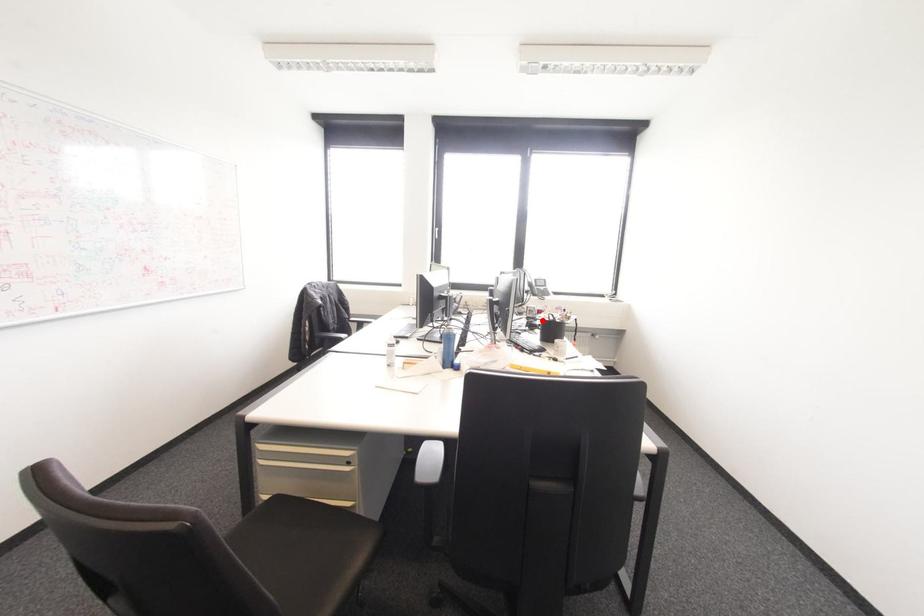
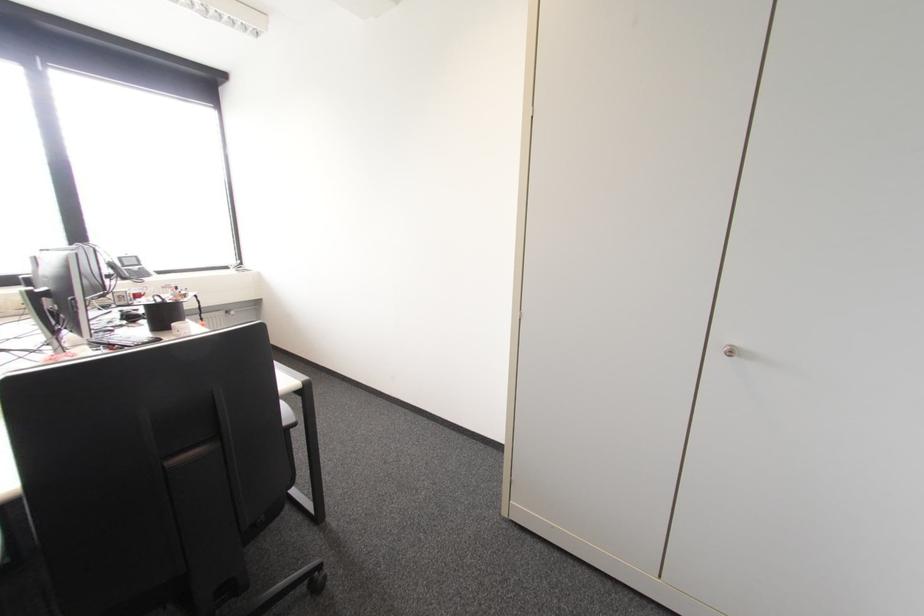
Find the pixel in the second image that matches the highlighted location in the first image.

(148, 306)